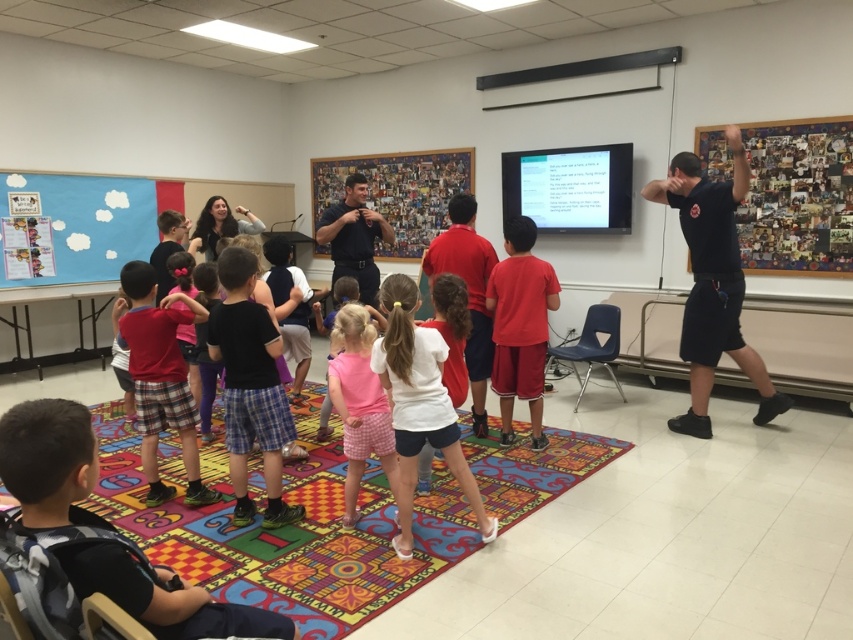
Question: Considering the real-world distances, which object is farthest from the pink checkered shorts at center?

Choices:
 (A) wooden collage board at upper right
 (B) matte red shorts at center
 (C) black uniform at upper right
 (D) matte blue bulletin board at upper left

Answer: (D)

Question: Among these points, which one is nearest to the camera?

Choices:
 (A) (137, 344)
 (B) (798, 218)
 (C) (416, 353)
 (D) (346, 346)

Answer: (C)

Question: Which point is farther to the camera?

Choices:
 (A) (53, 196)
 (B) (355, 260)
 (C) (415, 388)
 (D) (671, 188)

Answer: (A)

Question: Is the position of wooden collage board at upper right less distant than that of white matte shirt at center?

Choices:
 (A) no
 (B) yes

Answer: (A)

Question: Does black uniform at upper right come in front of matte blue bulletin board at upper left?

Choices:
 (A) yes
 (B) no

Answer: (A)

Question: In this image, where is black uniform at upper right located relative to matte red shorts at center?

Choices:
 (A) right
 (B) left

Answer: (A)